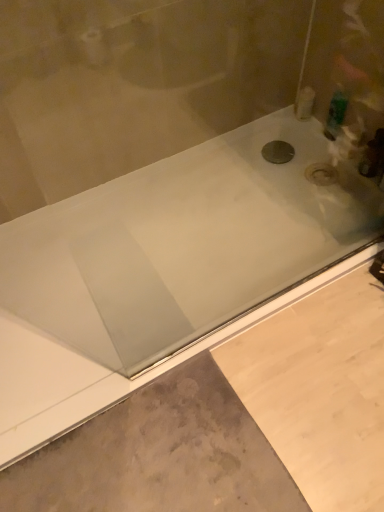
At what (x,y) coordinates should I click in order to perform the action: click on vacant space in front of white plastic bottle at upper right, arranged as the second toiletry when viewed from the right. Please return your answer as a coordinate pair (x, y). The width and height of the screenshot is (384, 512). Looking at the image, I should click on (297, 143).